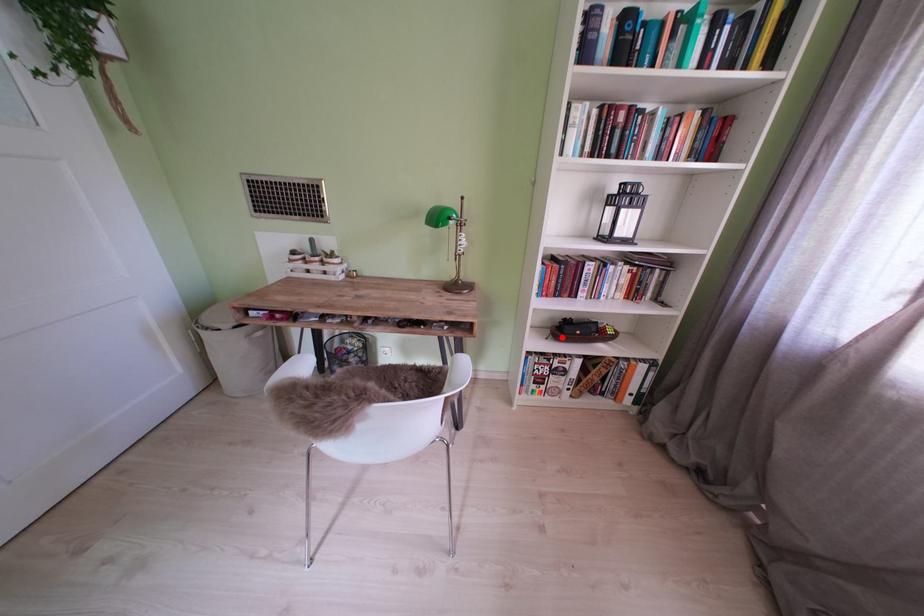
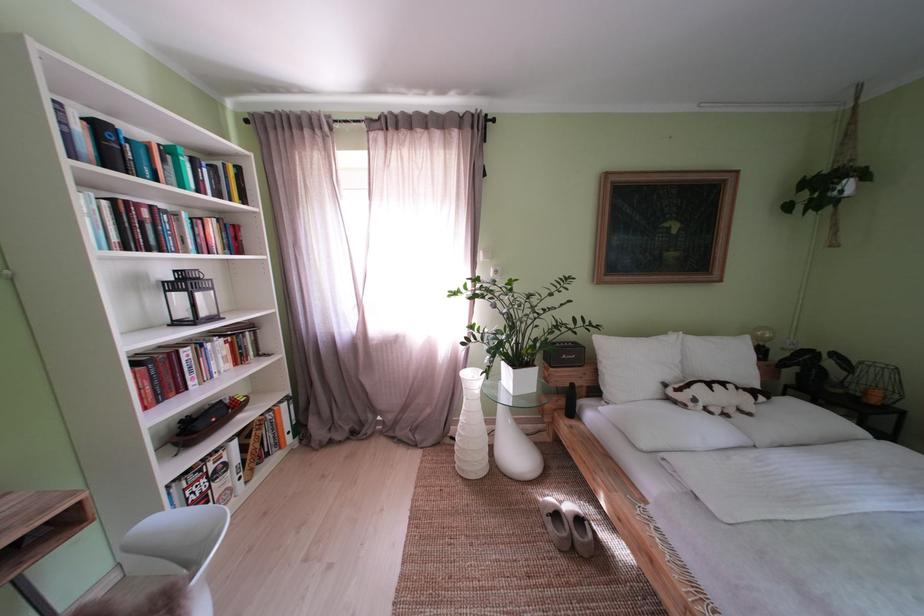
Where in the second image is the point corresponding to the highlighted location from the first image?

(187, 450)